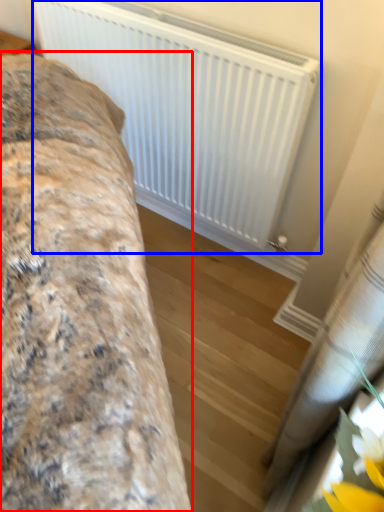
Question: Which object appears closest to the camera in this image, furniture (highlighted by a red box) or radiator (highlighted by a blue box)?

Choices:
 (A) furniture
 (B) radiator

Answer: (A)